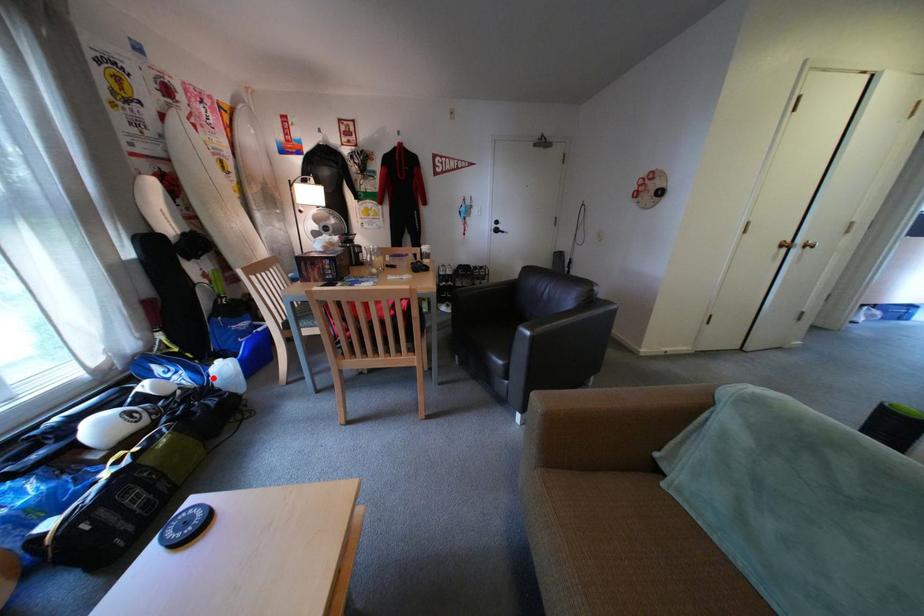
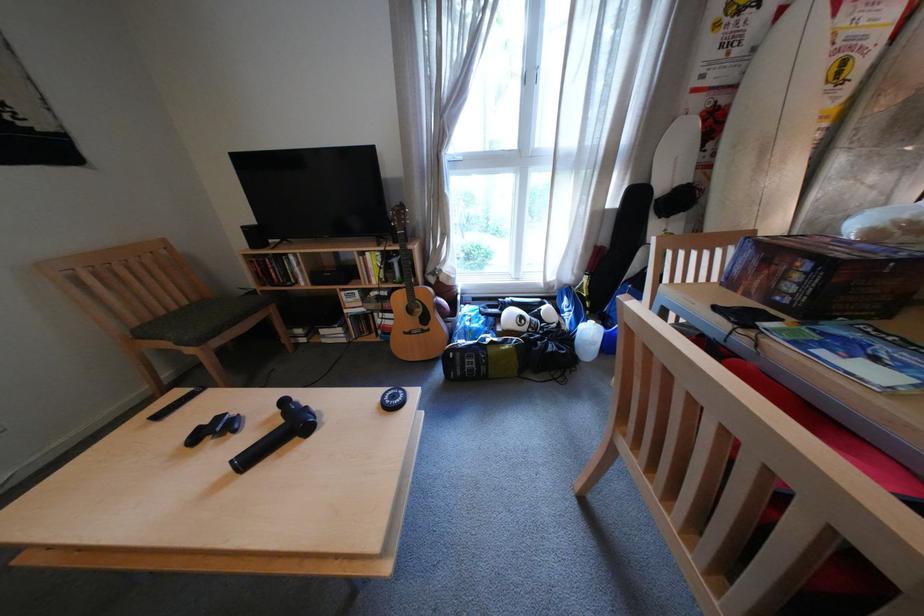
The point at the highlighted location is marked in the first image. Where is the corresponding point in the second image?

(589, 326)